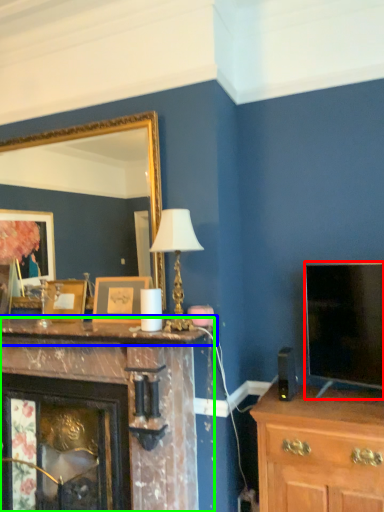
Question: Based on their relative distances, which object is farther from television (highlighted by a red box)? Choose from mantle (highlighted by a blue box) and fireplace (highlighted by a green box).

Choices:
 (A) mantle
 (B) fireplace

Answer: (B)